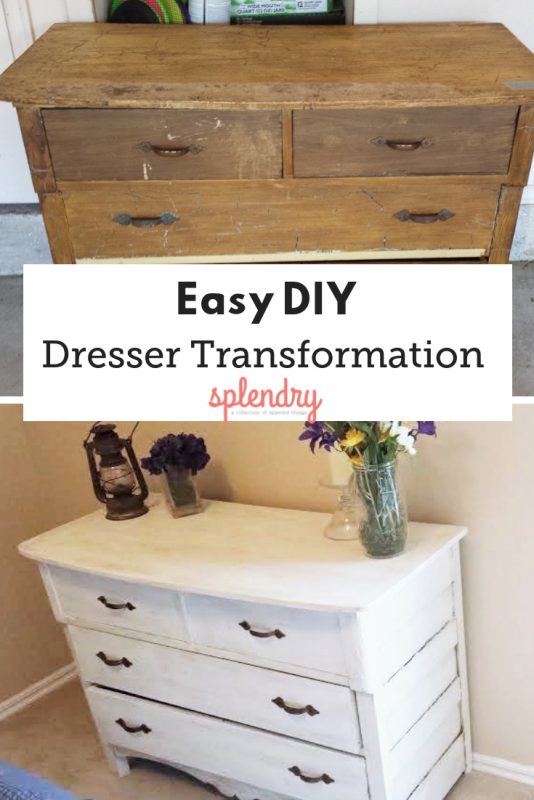
Locate an element on the screen. blanket is located at coordinates (26, 785).